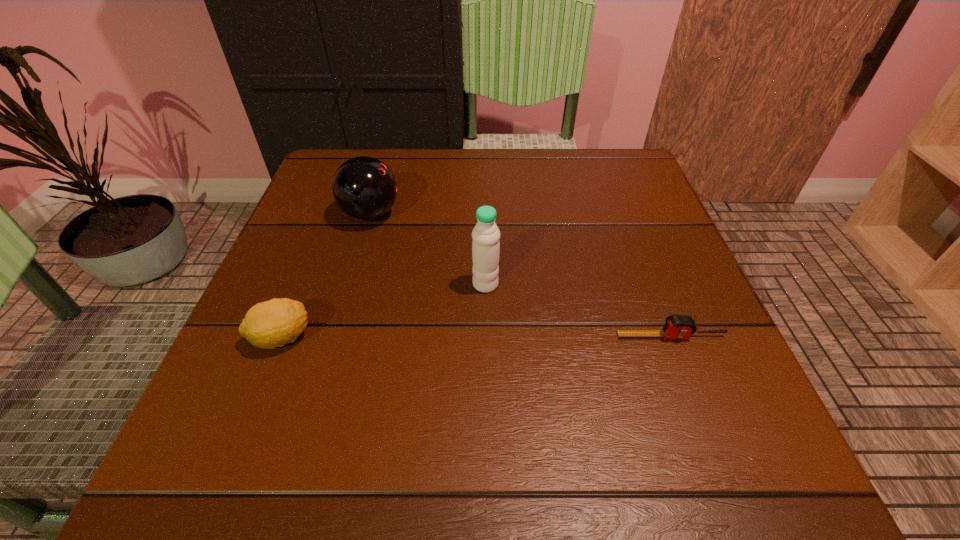
At what (x,y) coordinates should I click in order to perform the action: click on free space located on the back of the tape measure. Please return your answer as a coordinate pair (x, y). Looking at the image, I should click on coord(616,193).

You are a GUI agent. You are given a task and a screenshot of the screen. Output one action in this format:
    pyautogui.click(x=<x>, y=<y>)
    Task: Click on the object that is at the far edge
    The image size is (960, 540).
    Given the screenshot: What is the action you would take?
    pyautogui.click(x=364, y=188)

The height and width of the screenshot is (540, 960). I want to click on bowling ball positioned at the left edge, so tap(364, 188).

Identify the location of lemon at the left edge. (274, 323).

Find the location of a particular element. Image resolution: width=960 pixels, height=540 pixels. object at the right edge is located at coordinates (676, 326).

Identify the location of object that is at the far left corner. (364, 188).

At what (x,y) coordinates should I click in order to perform the action: click on vacant space at the far edge of the desktop. Please return your answer as a coordinate pair (x, y). Looking at the image, I should click on (478, 192).

This screenshot has width=960, height=540. What are the coordinates of `vacant space at the near edge of the desktop` in the screenshot? It's located at (346, 474).

In the image, there is a desktop. Where is `free space at the left edge`? free space at the left edge is located at coordinates (308, 232).

At what (x,y) coordinates should I click in order to perform the action: click on blank space at the right edge. Please return your answer as a coordinate pair (x, y). The image size is (960, 540). Looking at the image, I should click on click(640, 342).